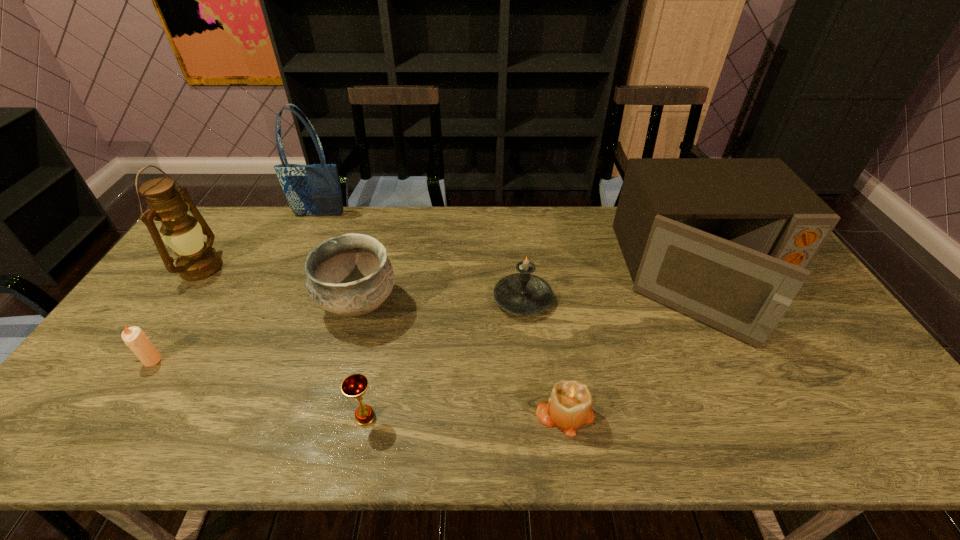
Find the location of a particular element. Image resolution: width=960 pixels, height=540 pixels. shopping bag is located at coordinates (311, 190).

Where is `the farthest object`? the farthest object is located at coordinates [311, 190].

You are a GUI agent. You are given a task and a screenshot of the screen. Output one action in this format:
    pyautogui.click(x=<x>, y=<y>)
    Task: Click on the oil lamp
    Image resolution: width=960 pixels, height=540 pixels.
    Given the screenshot: What is the action you would take?
    pyautogui.click(x=197, y=260)

The height and width of the screenshot is (540, 960). Identify the location of the rightmost object. (728, 241).

Identify the location of the third tallest object. The width and height of the screenshot is (960, 540). (728, 241).

Where is `pottery`? The height and width of the screenshot is (540, 960). pottery is located at coordinates (350, 275).

Locate an element on the screen. The height and width of the screenshot is (540, 960). the farthest candle is located at coordinates (522, 293).

This screenshot has width=960, height=540. Find the location of `the leftmost candle`. the leftmost candle is located at coordinates (134, 337).

Identify the location of chalice. This screenshot has height=540, width=960. (354, 386).

You are a GUI agent. You are given a task and a screenshot of the screen. Output one action in this format:
    pyautogui.click(x=<x>, y=<y>)
    Task: Click on the nearest candle
    This screenshot has height=540, width=960.
    Given the screenshot: What is the action you would take?
    pyautogui.click(x=569, y=407)